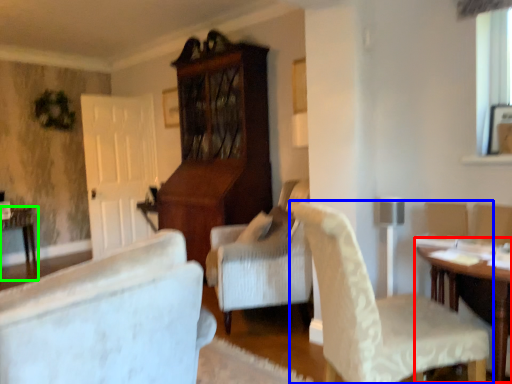
Question: Based on their relative distances, which object is farther from table (highlighted by a red box)? Choose from chair (highlighted by a blue box) and table (highlighted by a green box).

Choices:
 (A) chair
 (B) table

Answer: (B)